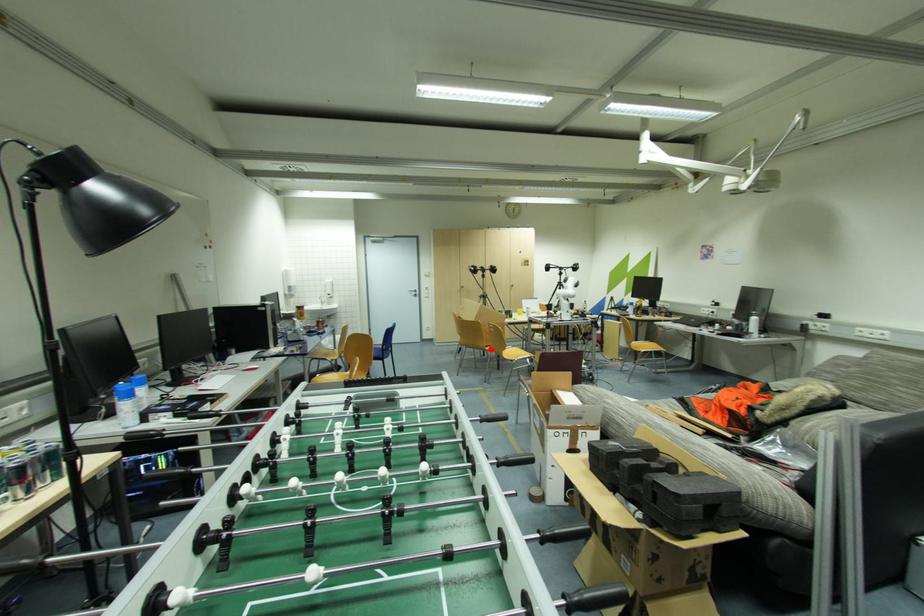
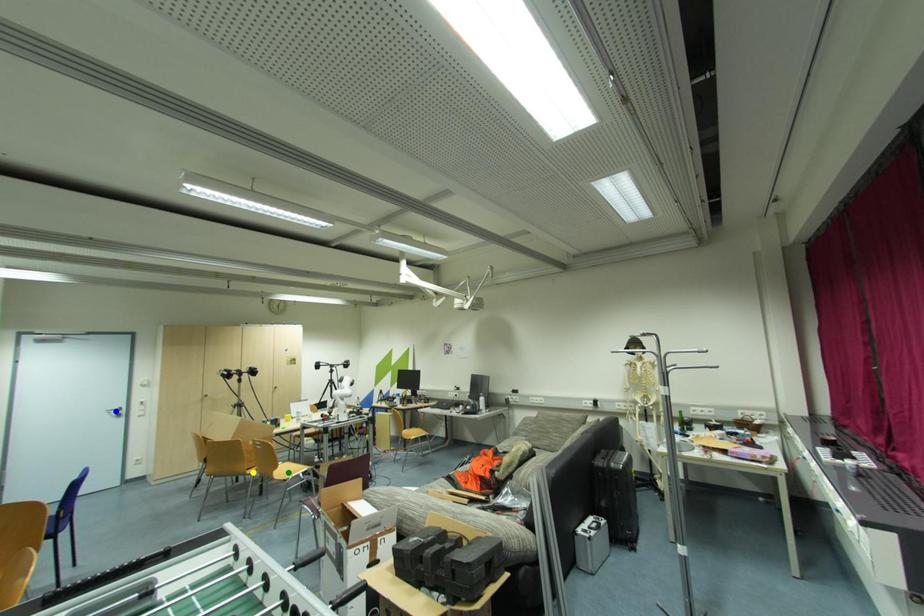
Question: I am providing you with two images of the same scene from different viewpoints. A red point is marked on the first image. You are given multiple points on the second image. Which mark in image 2 goes with the point in image 1?

Choices:
 (A) yellow point
 (B) blue point
 (C) green point

Answer: (A)